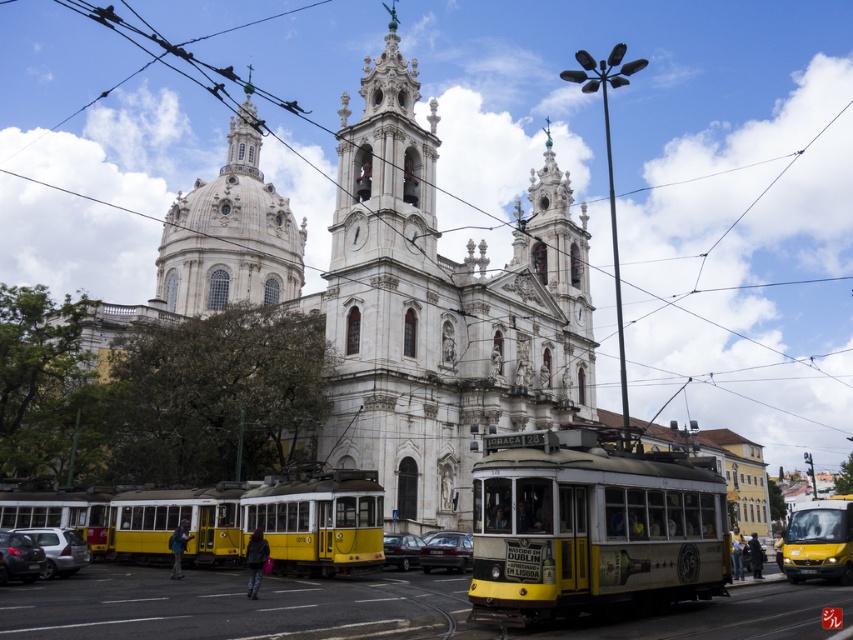
Question: Is white marble church at center to the left of dark gray matte car at center from the viewer's perspective?

Choices:
 (A) no
 (B) yes

Answer: (B)

Question: Which point is farther to the camera?

Choices:
 (A) silver metallic car at lower left
 (B) matte black car at center
 (C) white marble church at center

Answer: (C)

Question: Which of the following is the farthest from the observer?

Choices:
 (A) white marble church at center
 (B) silver metallic car at lower left
 (C) yellow matte van at center
 (D) white stone dome at upper center

Answer: (D)

Question: Does silver metallic car at lower left have a lesser width compared to dark gray matte car at center?

Choices:
 (A) yes
 (B) no

Answer: (A)

Question: Which point is farther to the camera?

Choices:
 (A) (405, 534)
 (B) (293, 240)
 (C) (434, 540)
 (D) (845, 552)

Answer: (B)

Question: Does yellow matte van at center come behind silver metallic car at lower left?

Choices:
 (A) no
 (B) yes

Answer: (B)